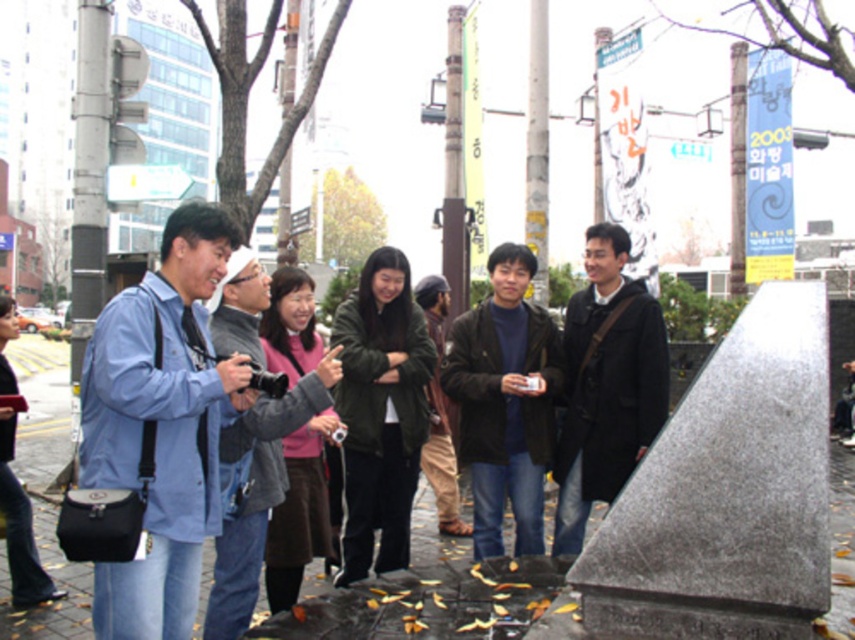
You are standing at point (193, 419) and want to take a photo of the monument. The camera you have can focus objects up to 3 meters away. Will you be able to capture the monument clearly?

The distance between point (193, 419) and the camera is 3.47 meters, which exceeds the camera focus limit of 3 meters. Therefore, you won not be able to capture the monument clearly.

You are a photographer trying to capture a photo of the dark green jacket at center while avoiding the monument. Where should you position yourself relative to the jacket to ensure the monument doesn not block the view?

The dark green jacket at center is located at point (380, 412). To avoid the monument, position yourself to the side or behind the jacket, ensuring the monument is out of frame.